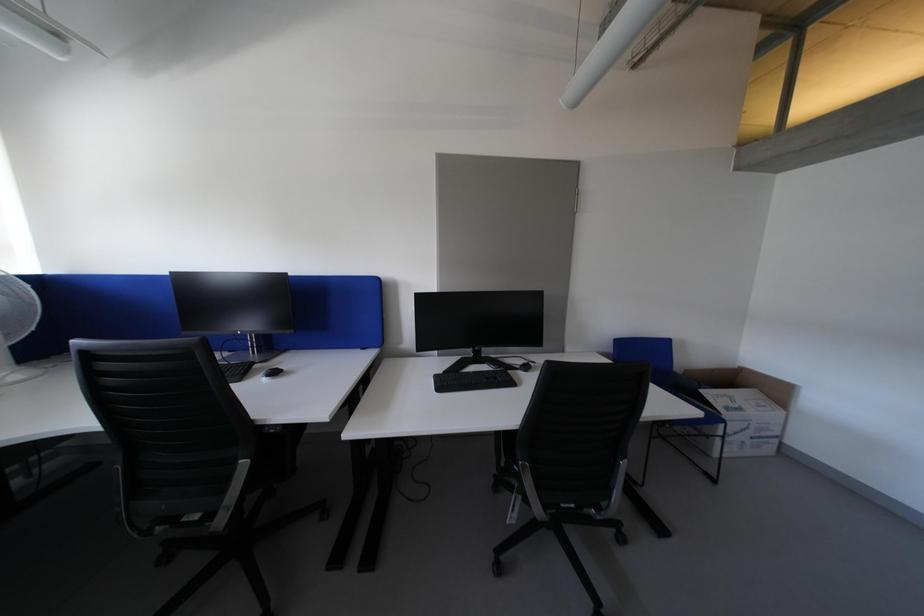
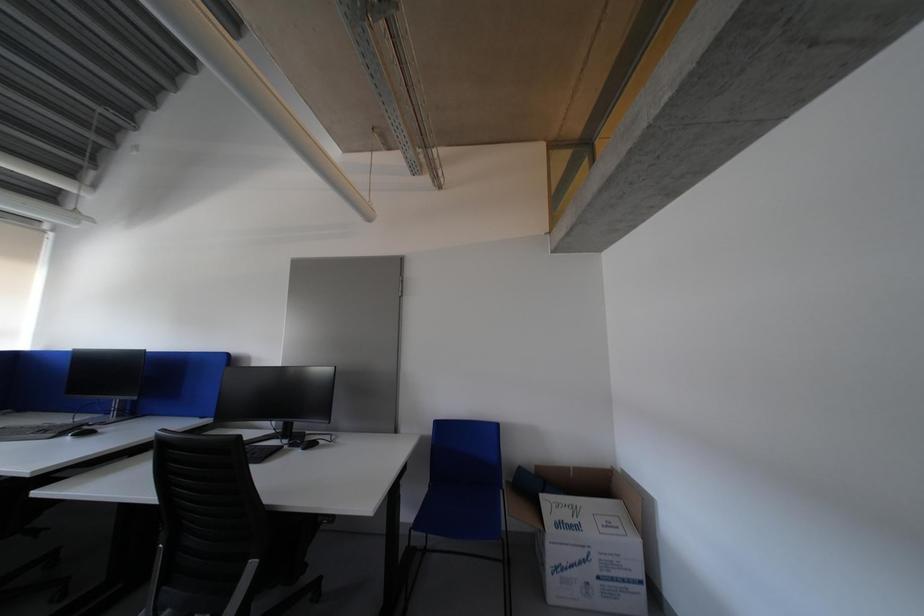
Question: The images are taken continuously from a first-person perspective. In which direction are you moving?

Choices:
 (A) Left
 (B) Right
 (C) Forward
 (D) Backward

Answer: (B)